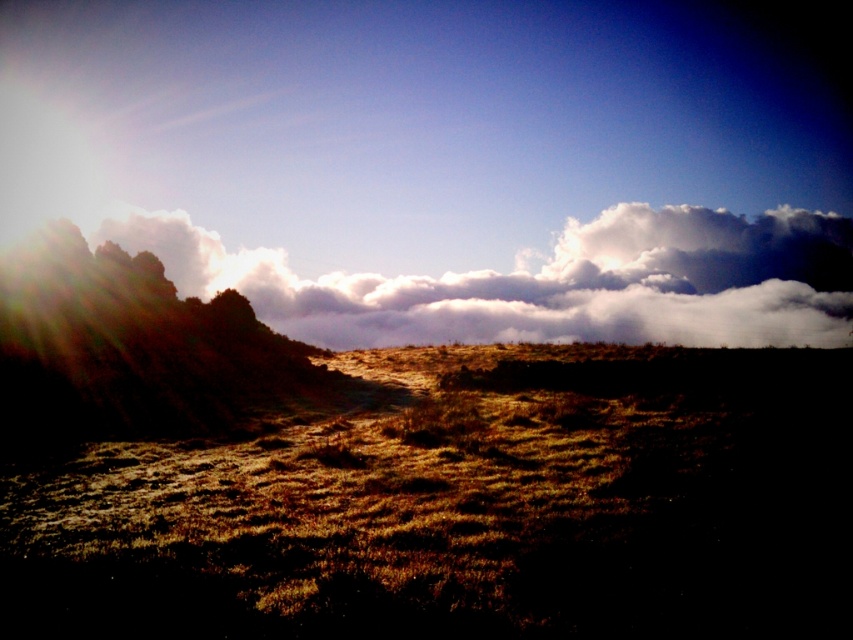
You are standing in the middle of the brown textured grass at center and looking towards the white fluffy cloud at upper center. Which object is nearer to you?

The brown textured grass at center is closer to the viewer than the white fluffy cloud at upper center.

You are standing in the middle of the grassy field and see two points in the scene. One is labeled as point (815, 589) and the other as point (614, 289). Which point is closer to you?

Point (815, 589) is in front of point (614, 289), so it is closer to you.

You are standing at the origin point in the scene and want to reach the brown textured grass at center. Which direction should you move in to get there?

The brown textured grass at center is located at point (467, 508), so you should move towards the right and forward to reach it.